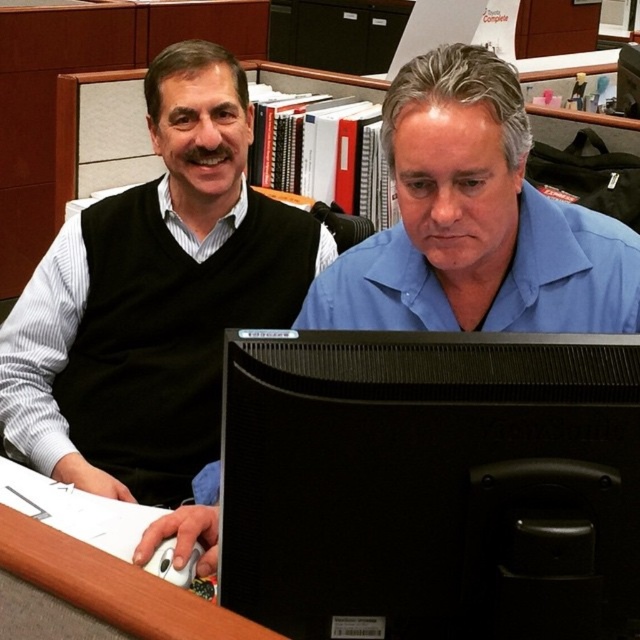
You are standing in front of the desk and want to reach the point at coordinates (560, 420). Considering the objects on the desk, can you estimate whether this point is within your reach without moving the desk?

The point at coordinates (560, 420) is 29.16 inches away from the viewer, so it is within reach without moving the desk.

You are standing in front of the desk in the office scene. The black glossy computer monitor at center is positioned at coordinates 0.758 on the x and 0.675 on the y axis. If you need to place a new keyboard exactly 10 cm to the right of the monitor, where would you place it?

The black glossy computer monitor at center is located at point (432, 484). To place a new keyboard 10 cm to the right, you would position it at approximately 0.858 on the x axis while keeping the y coordinate at 0.675.